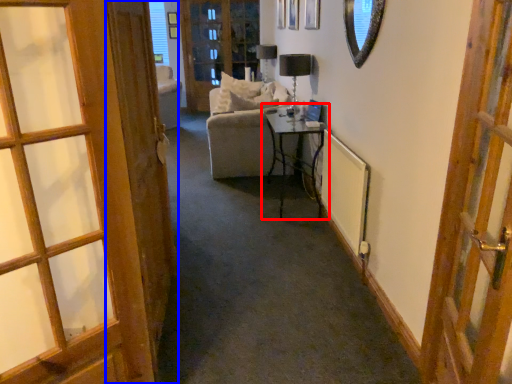
Question: Which point is closer to the camera, table (highlighted by a red box) or door (highlighted by a blue box)?

Choices:
 (A) table
 (B) door

Answer: (B)